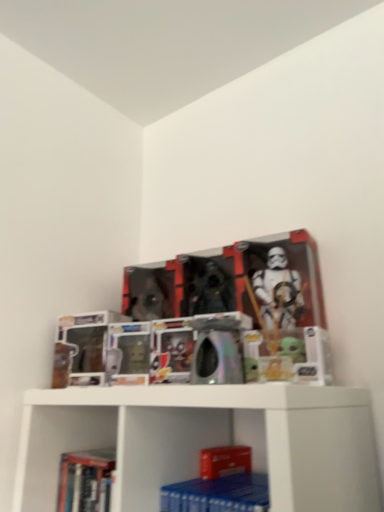
Question: Considering the positions of point (183, 502) and point (74, 499), is point (183, 502) closer or farther from the camera than point (74, 499)?

Choices:
 (A) farther
 (B) closer

Answer: (B)

Question: Considering the relative positions of blue matte paperback book at lower center and hardcover book at lower left in the image provided, is blue matte paperback book at lower center to the left or to the right of hardcover book at lower left?

Choices:
 (A) right
 (B) left

Answer: (A)

Question: Is blue matte paperback book at lower center inside the boundaries of hardcover book at lower left, or outside?

Choices:
 (A) inside
 (B) outside

Answer: (B)

Question: Considering the relative positions of hardcover book at lower left and blue matte paperback book at lower center in the image provided, is hardcover book at lower left to the left or to the right of blue matte paperback book at lower center?

Choices:
 (A) right
 (B) left

Answer: (B)

Question: In terms of size, does hardcover book at lower left appear bigger or smaller than blue matte paperback book at lower center?

Choices:
 (A) small
 (B) big

Answer: (B)

Question: Is hardcover book at lower left wider or thinner than blue matte paperback book at lower center?

Choices:
 (A) wide
 (B) thin

Answer: (B)

Question: Is hardcover book at lower left taller or shorter than blue matte paperback book at lower center?

Choices:
 (A) tall
 (B) short

Answer: (A)